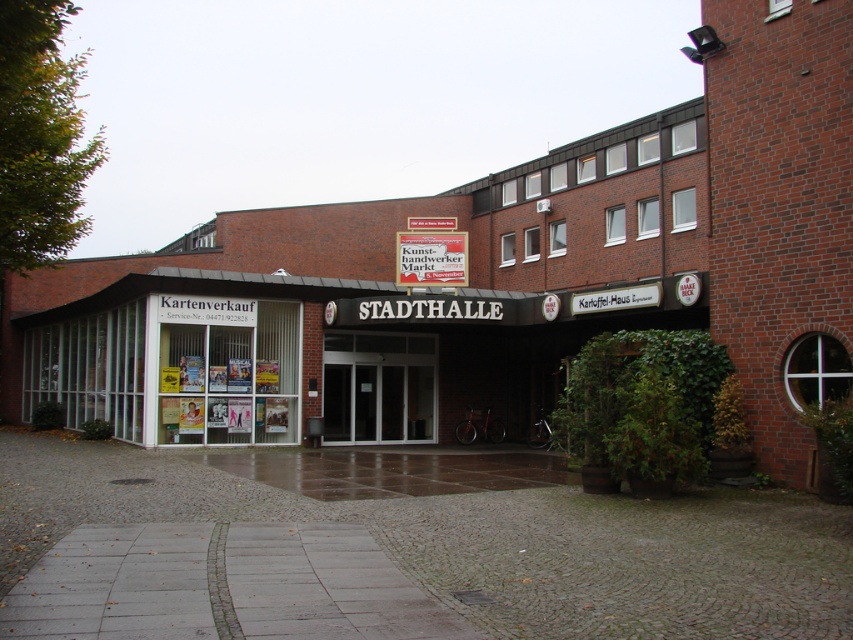
The width and height of the screenshot is (853, 640). What are the coordinates of `gray cobblestone pavement at center` in the screenshot? It's located at (398, 556).

Who is more forward, [347,586] or [404,234]?

Point [347,586] is more forward.

At what (x,y) coordinates should I click in order to perform the action: click on gray cobblestone pavement at center. Please return your answer as a coordinate pair (x, y). The height and width of the screenshot is (640, 853). Looking at the image, I should click on (398, 556).

Find the location of a particular element. The width and height of the screenshot is (853, 640). gray cobblestone pavement at center is located at coordinates (398, 556).

Is transparent glass door at center taller than red cardboard sign at center?

Yes, transparent glass door at center is taller than red cardboard sign at center.

Is transparent glass door at center to the right of red cardboard sign at center from the viewer's perspective?

In fact, transparent glass door at center is to the left of red cardboard sign at center.

This screenshot has height=640, width=853. I want to click on transparent glass door at center, so click(x=378, y=387).

Who is higher up, gray cobblestone pavement at center or white glass storefront at center?

white glass storefront at center

Between point (828, 592) and point (184, 342), which one is positioned in front?

Positioned in front is point (828, 592).

Find the location of a particular element. This screenshot has width=853, height=640. gray cobblestone pavement at center is located at coordinates (398, 556).